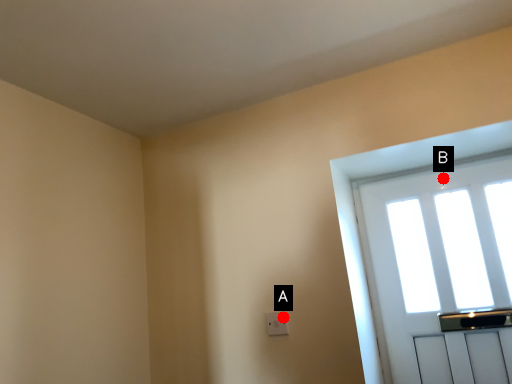
Question: Two points are circled on the image, labeled by A and B beside each circle. Which of the following is the farthest from the observer?

Choices:
 (A) A is further
 (B) B is further

Answer: (B)